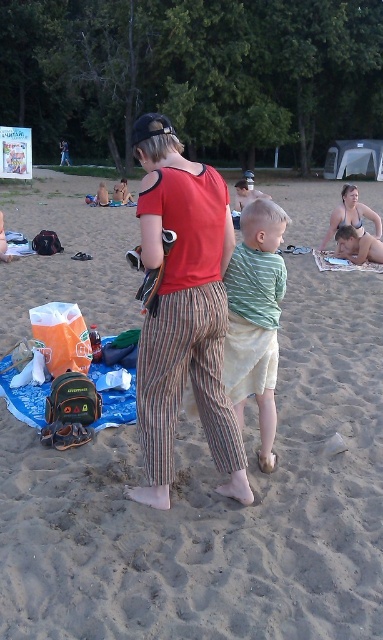
Question: Is green striped shirt at center in front of matte black bikini top at upper right?

Choices:
 (A) no
 (B) yes

Answer: (B)

Question: Which object appears farthest from the camera in this image?

Choices:
 (A) sandy beach at center
 (B) green striped shirt at center

Answer: (B)

Question: Does sandy beach at center come behind matte black bikini top at upper right?

Choices:
 (A) yes
 (B) no

Answer: (B)

Question: Which object is farther from the camera taking this photo?

Choices:
 (A) sandy beach at center
 (B) green striped shirt at center

Answer: (B)

Question: Which of the following is the farthest from the observer?

Choices:
 (A) green striped shirt at center
 (B) sandy beach at center

Answer: (A)

Question: Is green striped shirt at center to the left of matte black bikini top at upper right from the viewer's perspective?

Choices:
 (A) no
 (B) yes

Answer: (B)